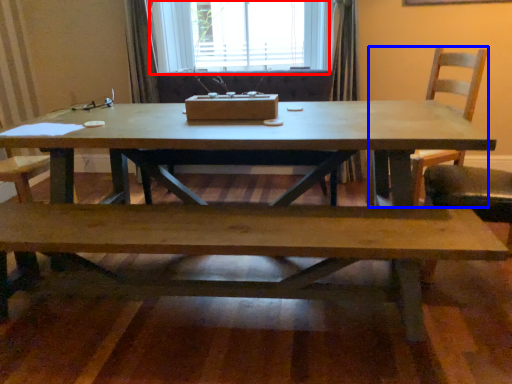
Question: Which object appears closest to the camera in this image, window (highlighted by a red box) or chair (highlighted by a blue box)?

Choices:
 (A) window
 (B) chair

Answer: (B)